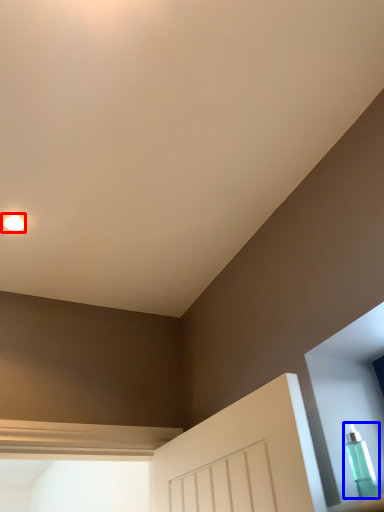
Question: Which of the following is the farthest to the observer, droplight (highlighted by a red box) or bottle (highlighted by a blue box)?

Choices:
 (A) droplight
 (B) bottle

Answer: (A)